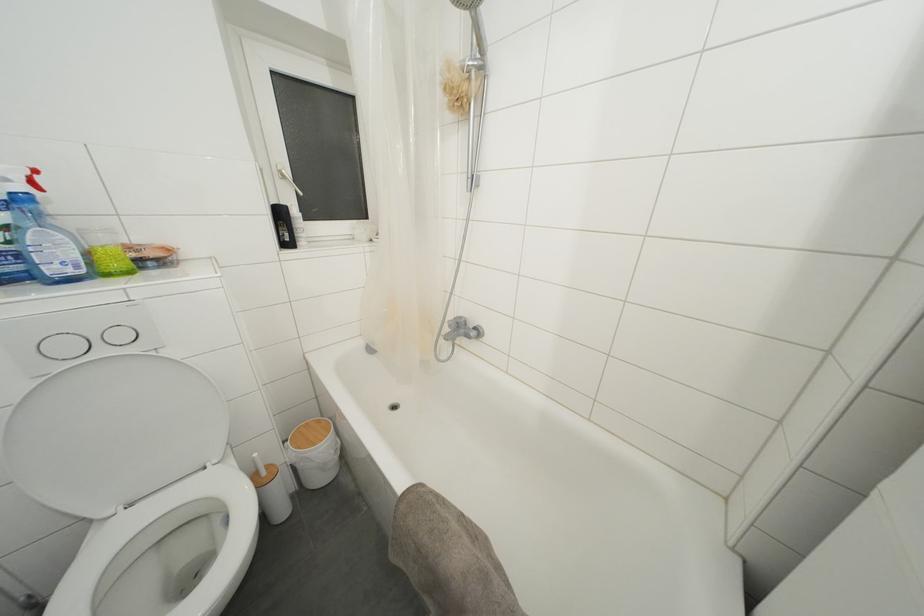
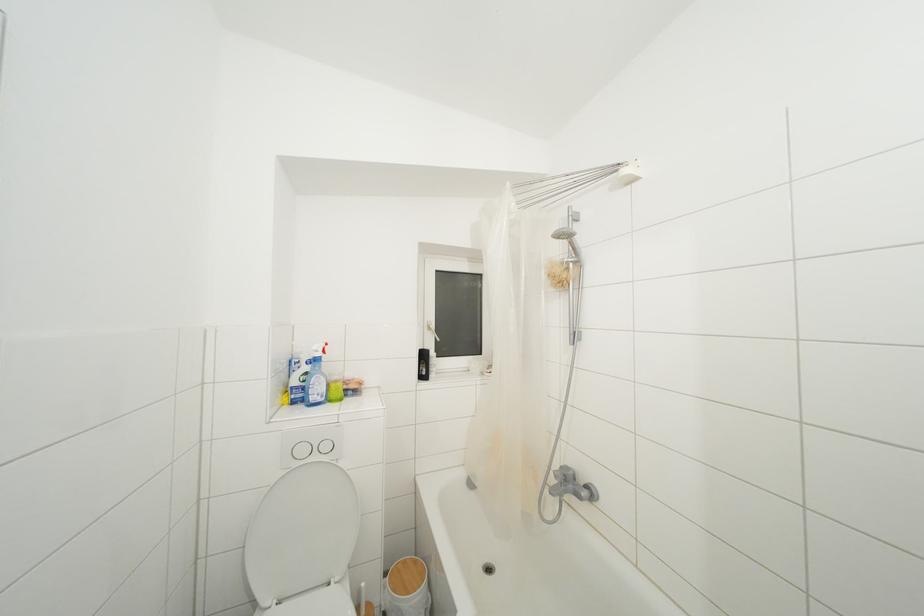
Where in the second image is the point corresponding to (x=285, y=219) from the first image?

(428, 361)